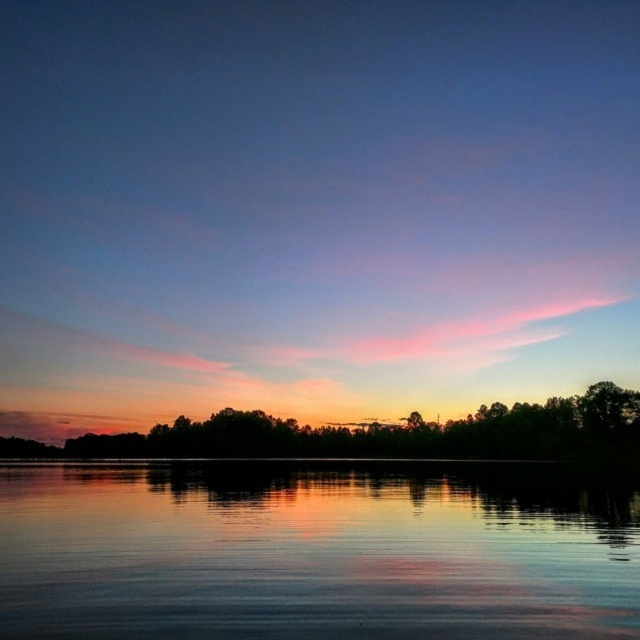
Who is more forward, (490,481) or (568,426)?

Point (490,481) is more forward.

Is smooth reflective water at center wider than green matte trees at center?

Incorrect, smooth reflective water at center's width does not surpass green matte trees at center's.

Is point (340, 593) positioned behind point (96, 452)?

No, (340, 593) is in front of (96, 452).

What are the coordinates of `smooth reflective water at center` in the screenshot? It's located at (314, 552).